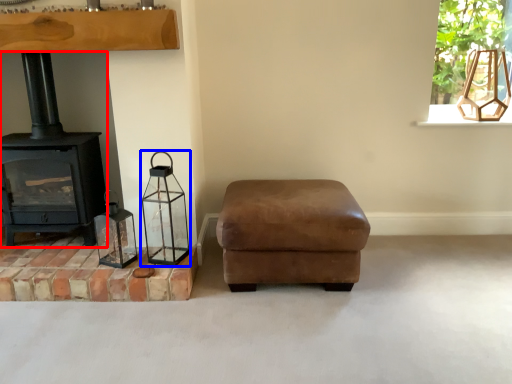
Question: Which object is further to the camera taking this photo, wood burning stove (highlighted by a red box) or candle holder (highlighted by a blue box)?

Choices:
 (A) wood burning stove
 (B) candle holder

Answer: (A)